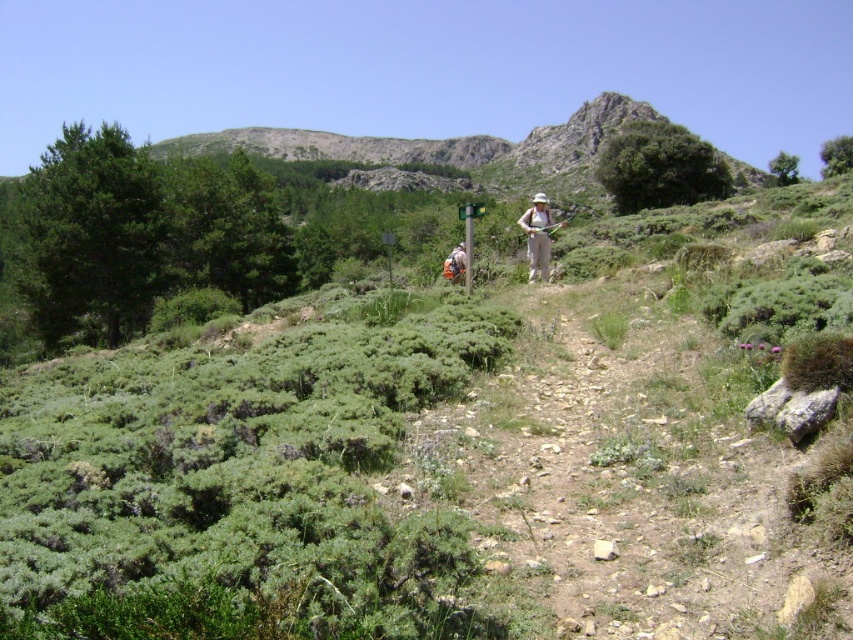
Does green leafy shrubbery at center have a smaller size compared to khaki pants at center?

Actually, green leafy shrubbery at center might be larger than khaki pants at center.

Which is in front, point (68, 568) or point (561, 221)?

Point (68, 568) is in front.

Is point (744, 621) positioned behind point (535, 204)?

No, (744, 621) is in front of (535, 204).

This screenshot has width=853, height=640. What are the coordinates of `green leafy shrubbery at center` in the screenshot? It's located at (456, 458).

Which of these two, khaki pants at center or camouflage fabric backpack at center, stands taller?

khaki pants at center is taller.

The height and width of the screenshot is (640, 853). Describe the element at coordinates (538, 236) in the screenshot. I see `khaki pants at center` at that location.

Locate an element on the screen. khaki pants at center is located at coordinates (538, 236).

Looking at this image, is green leafy shrubbery at center closer to the viewer compared to camouflage fabric backpack at center?

Yes, green leafy shrubbery at center is closer to the viewer.

Is point (788, 241) in front of point (450, 268)?

Yes, point (788, 241) is closer to viewer.

This screenshot has height=640, width=853. What do you see at coordinates (456, 458) in the screenshot?
I see `green leafy shrubbery at center` at bounding box center [456, 458].

At what (x,y) coordinates should I click in order to perform the action: click on green leafy shrubbery at center. Please return your answer as a coordinate pair (x, y). Looking at the image, I should click on (456, 458).